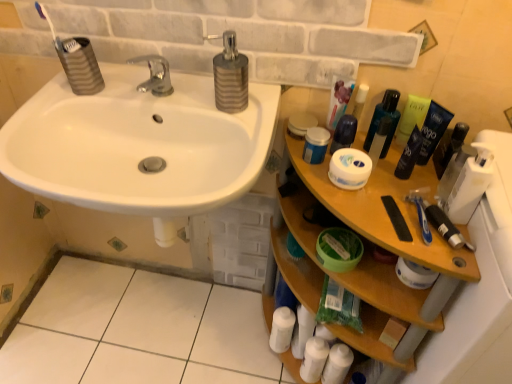
The image size is (512, 384). Identify the location of free space in front of translucent plastic toothbrush at upper left, which ranks as the first toothbrush in left-to-right order. (47, 123).